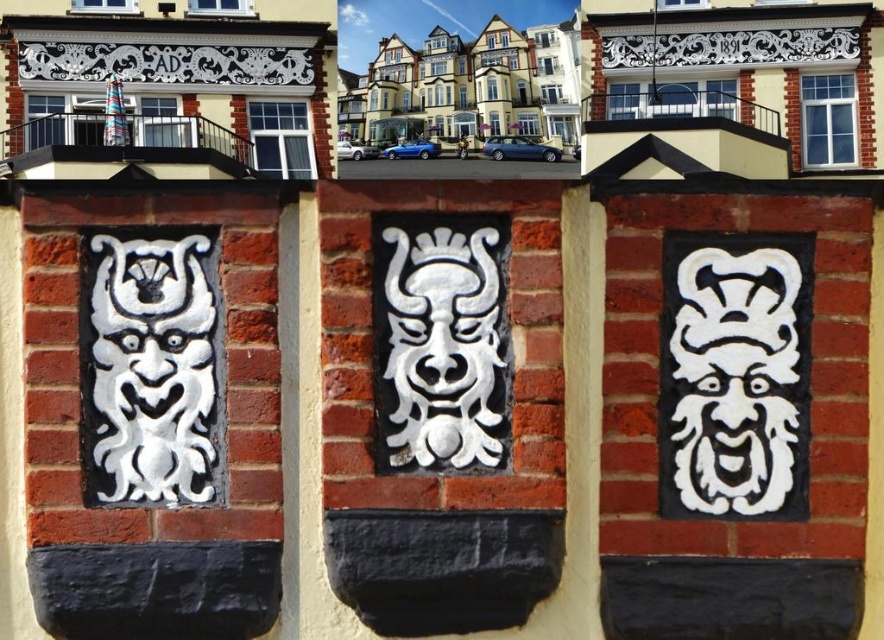
Identify the location of white painted stone mask at center. (443, 346).

Does white painted stone mask at center have a lesser width compared to white matte stone mask at center?

Correct, white painted stone mask at center's width is less than white matte stone mask at center's.

Who is more forward, (427,307) or (690,304)?

Point (427,307)

Identify the location of white painted stone mask at center. The image size is (884, 640). (443, 346).

The image size is (884, 640). What do you see at coordinates (153, 369) in the screenshot?
I see `white matte mask at center left` at bounding box center [153, 369].

In order to click on white matte mask at center left in this screenshot , I will do `click(153, 369)`.

Between point (166, 272) and point (741, 310), which one is positioned behind?

Point (741, 310)

Locate an element on the screen. This screenshot has height=640, width=884. white matte mask at center left is located at coordinates (153, 369).

Consider the image. Can you confirm if white matte mask at center left is positioned below white painted stone mask at center?

Yes.

Which is in front, point (98, 282) or point (486, 349)?

Positioned in front is point (486, 349).

Is point (204, 346) positioned after point (459, 241)?

Yes.

Find the location of `white matte mask at center left`. white matte mask at center left is located at coordinates (153, 369).